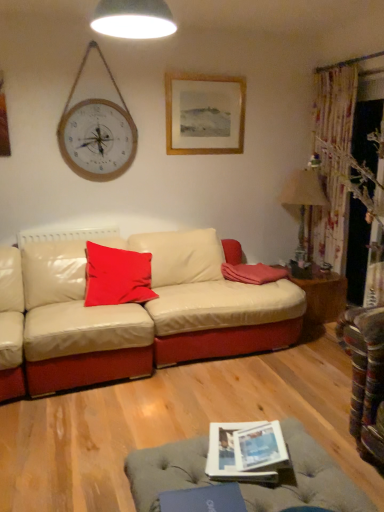
What do you see at coordinates (133, 19) in the screenshot? This screenshot has width=384, height=512. I see `white glossy lampshade at upper center, placed as the 1th lamp when sorted from front to back` at bounding box center [133, 19].

What do you see at coordinates (253, 273) in the screenshot? I see `soft pink fabric pillow at center, positioned as the first pillow in right-to-left order` at bounding box center [253, 273].

Consider the image. What is the approximate height of wooden side table at right?

wooden side table at right is 15.58 inches in height.

Locate an element on the screen. The width and height of the screenshot is (384, 512). matte paper magazine at lower center is located at coordinates (239, 449).

How many degrees apart are the facing directions of matte red cushion at center, the 2th pillow from the right, and matte paper magazine at lower center?

The angular difference between matte red cushion at center, the 2th pillow from the right, and matte paper magazine at lower center is 23.6 degrees.

From the image's perspective, which one is positioned lower, matte red cushion at center, which is counted as the 1th pillow, starting from the left, or matte paper magazine at lower center?

matte paper magazine at lower center is shown below in the image.

From a real-world perspective, who is located higher, matte red cushion at center, which is counted as the 1th pillow, starting from the left, or matte paper magazine at lower center?

From a 3D spatial view, matte red cushion at center, which is counted as the 1th pillow, starting from the left, is above.

Is point (86, 298) less distant than point (217, 468)?

No, it is behind (217, 468).

From the image's perspective, is wooden framed picture at upper center over beige fabric lampshade at right, which appears as the 1th lamp when ordered from the bottom?

Correct, wooden framed picture at upper center appears higher than beige fabric lampshade at right, which appears as the 1th lamp when ordered from the bottom, in the image.

Does wooden framed picture at upper center lie in front of beige fabric lampshade at right, the second lamp viewed from the front?

That is True.

Considering the sizes of objects wooden framed picture at upper center and beige fabric lampshade at right, which is counted as the 2th lamp, starting from the left, in the image provided, who is taller, wooden framed picture at upper center or beige fabric lampshade at right, which is counted as the 2th lamp, starting from the left,?

beige fabric lampshade at right, which is counted as the 2th lamp, starting from the left, is taller.

In the scene shown: From a real-world perspective, relative to beige fabric lampshade at right, which appears as the first lamp when viewed from the back, is wooden framed picture at upper center vertically above or below?

From a real-world perspective, wooden framed picture at upper center is physically above beige fabric lampshade at right, which appears as the first lamp when viewed from the back.

Who is bigger, white glossy lampshade at upper center, the second lamp from the bottom, or beige fabric lampshade at right, the second lamp viewed from the front?

beige fabric lampshade at right, the second lamp viewed from the front.

Is beige fabric lampshade at right, the first lamp viewed from the right, surrounded by white glossy lampshade at upper center, the second lamp from the bottom?

No.

Is white glossy lampshade at upper center, placed as the 2th lamp when sorted from right to left, next to beige fabric lampshade at right, which is counted as the 2th lamp, starting from the left?

They are not placed beside each other.

Based on their positions, is white glossy lampshade at upper center, the second lamp from the bottom, located to the left or right of beige fabric lampshade at right, the first lamp viewed from the right?

In the image, white glossy lampshade at upper center, the second lamp from the bottom, appears on the left side of beige fabric lampshade at right, the first lamp viewed from the right.

Is matte paper magazine at lower center wider than wooden framed picture at upper center?

Indeed, matte paper magazine at lower center has a greater width compared to wooden framed picture at upper center.

From a real-world perspective, which object stands above the other?

From a 3D spatial view, wooden framed picture at upper center is above.

Is matte paper magazine at lower center closer to the viewer compared to wooden framed picture at upper center?

Yes, the depth of matte paper magazine at lower center is less than that of wooden framed picture at upper center.

Would you say matte paper magazine at lower center is a long distance from wooden framed picture at upper center?

matte paper magazine at lower center is positioned a significant distance from wooden framed picture at upper center.

Which is more to the left, matte paper magazine at lower center or beige fabric lampshade at right, which appears as the 1th lamp when ordered from the bottom?

Positioned to the left is matte paper magazine at lower center.

Is matte paper magazine at lower center placed right next to beige fabric lampshade at right, which is the second lamp from top to bottom?

No.

From a real-world perspective, is matte paper magazine at lower center physically above beige fabric lampshade at right, which is counted as the 2th lamp, starting from the left?

No, from a real-world perspective, matte paper magazine at lower center is not over beige fabric lampshade at right, which is counted as the 2th lamp, starting from the left

From the image's perspective, who appears lower, matte paper magazine at lower center or beige fabric lampshade at right, the second lamp viewed from the front?

matte paper magazine at lower center appears lower in the image.

Does matte paper magazine at lower center turn towards white glossy lampshade at upper center, acting as the first lamp starting from the left?

No.

Which object is further away from the camera, matte paper magazine at lower center or white glossy lampshade at upper center, arranged as the 1th lamp when viewed from the top?

white glossy lampshade at upper center, arranged as the 1th lamp when viewed from the top, is further away from the camera.

From the image's perspective, which is above, matte paper magazine at lower center or white glossy lampshade at upper center, which is counted as the 2th lamp, starting from the back?

white glossy lampshade at upper center, which is counted as the 2th lamp, starting from the back, from the image's perspective.

Between matte paper magazine at lower center and white glossy lampshade at upper center, which is counted as the 2th lamp, starting from the back, which one appears on the left side from the viewer's perspective?

white glossy lampshade at upper center, which is counted as the 2th lamp, starting from the back.

Would you say wooden side table at right is a long distance from beige fabric lampshade at right, the second lamp viewed from the front?

Actually, wooden side table at right and beige fabric lampshade at right, the second lamp viewed from the front, are a little close together.

From the picture: Is wooden side table at right oriented towards beige fabric lampshade at right, which appears as the first lamp when viewed from the back?

No, wooden side table at right is not turned towards beige fabric lampshade at right, which appears as the first lamp when viewed from the back.

From a real-world perspective, between wooden side table at right and beige fabric lampshade at right, which appears as the first lamp when viewed from the back, who is vertically higher?

beige fabric lampshade at right, which appears as the first lamp when viewed from the back.

This screenshot has height=512, width=384. Find the location of `pillow on the left of the matte paper magazine at lower center`. pillow on the left of the matte paper magazine at lower center is located at coordinates (117, 276).

At what (x,y) coordinates should I click in order to perform the action: click on lamp behind the wooden framed picture at upper center. Please return your answer as a coordinate pair (x, y). The image size is (384, 512). Looking at the image, I should click on (303, 199).

From the picture: When comparing their distances from matte red cushion at center, the 2th pillow from the right, does wooden side table at right or beige fabric lampshade at right, which is counted as the 2th lamp, starting from the left, seem closer?

wooden side table at right is closer to matte red cushion at center, the 2th pillow from the right.

Based on their spatial positions, is white glossy lampshade at upper center, which is counted as the 2th lamp, starting from the back, or matte paper magazine at lower center further from soft pink fabric pillow at center, positioned as the first pillow in right-to-left order?

white glossy lampshade at upper center, which is counted as the 2th lamp, starting from the back, lies further to soft pink fabric pillow at center, positioned as the first pillow in right-to-left order, than the other object.

When comparing their distances from wooden framed picture at upper center, does wooden side table at right or beige fabric lampshade at right, which appears as the 1th lamp when ordered from the bottom, seem further?

wooden side table at right.

Based on their spatial positions, is beige fabric lampshade at right, the first lamp viewed from the right, or soft pink fabric pillow at center, the second pillow positioned from the left, further from matte red cushion at center, the 2th pillow from the right?

The object further to matte red cushion at center, the 2th pillow from the right, is beige fabric lampshade at right, the first lamp viewed from the right.

Based on their spatial positions, is beige fabric lampshade at right, which is counted as the 2th lamp, starting from the left, or wooden framed picture at upper center closer to soft pink fabric pillow at center, the second pillow positioned from the left?

Among the two, beige fabric lampshade at right, which is counted as the 2th lamp, starting from the left, is located nearer to soft pink fabric pillow at center, the second pillow positioned from the left.

Which object lies further to the anchor point beige fabric lampshade at right, which appears as the first lamp when viewed from the back, wooden side table at right or soft pink fabric pillow at center, the second pillow positioned from the left?

soft pink fabric pillow at center, the second pillow positioned from the left, is further to beige fabric lampshade at right, which appears as the first lamp when viewed from the back.

Considering their positions, is matte red cushion at center, the 2th pillow from the right, positioned further to wooden framed picture at upper center than matte paper magazine at lower center?

matte paper magazine at lower center is positioned further to the anchor wooden framed picture at upper center.

Which object lies nearer to the anchor point wooden side table at right, soft pink fabric pillow at center, positioned as the first pillow in right-to-left order, or wooden framed picture at upper center?

soft pink fabric pillow at center, positioned as the first pillow in right-to-left order, lies closer to wooden side table at right than the other object.

Locate an element on the screen. The height and width of the screenshot is (512, 384). lamp located between matte paper magazine at lower center and beige fabric lampshade at right, which is counted as the 2th lamp, starting from the left, in the depth direction is located at coordinates (133, 19).

You are a GUI agent. You are given a task and a screenshot of the screen. Output one action in this format:
    pyautogui.click(x=<x>, y=<y>)
    Task: Click on the picture frame positioned between white glossy lampshade at upper center, acting as the first lamp starting from the left, and wooden side table at right from near to far
    The image size is (384, 512).
    Given the screenshot: What is the action you would take?
    pyautogui.click(x=204, y=114)

Where is `picture frame between matte paper magazine at lower center and wooden side table at right from front to back`? Image resolution: width=384 pixels, height=512 pixels. picture frame between matte paper magazine at lower center and wooden side table at right from front to back is located at coordinates (204, 114).

At what (x,y) coordinates should I click in order to perform the action: click on pillow that lies between wooden framed picture at upper center and soft pink fabric pillow at center, the second pillow positioned from the left, from top to bottom. Please return your answer as a coordinate pair (x, y). The width and height of the screenshot is (384, 512). Looking at the image, I should click on (117, 276).